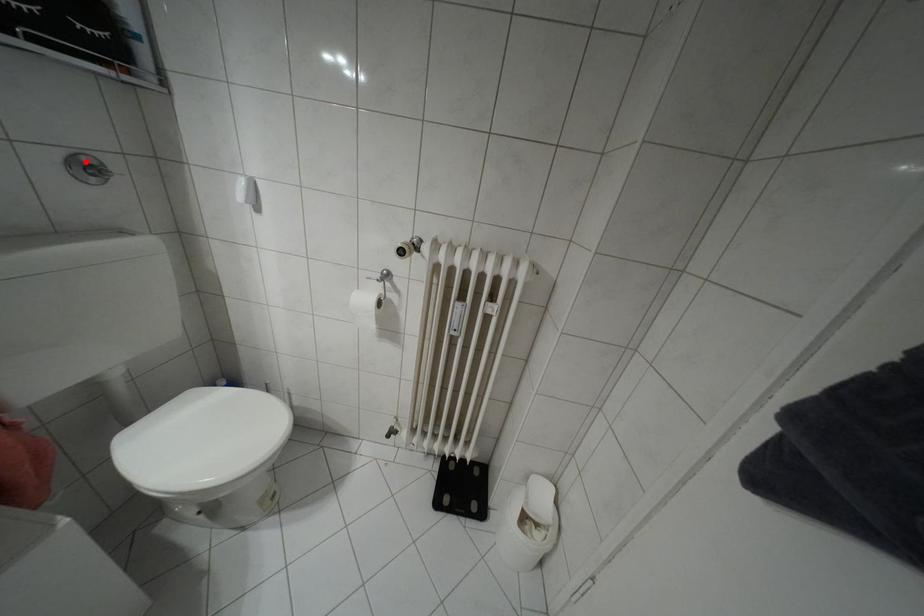
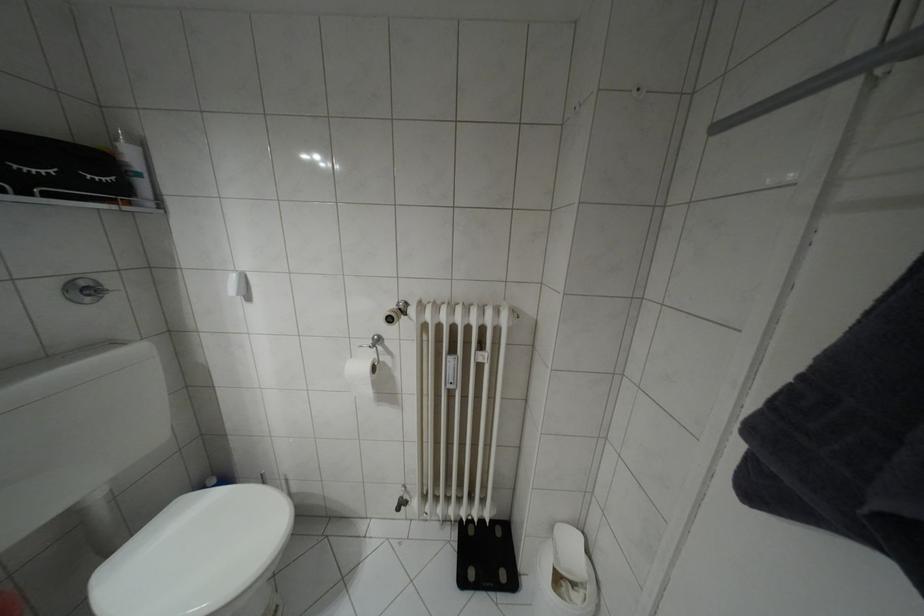
The point at the highlighted location is marked in the first image. Where is the corresponding point in the second image?

(81, 284)